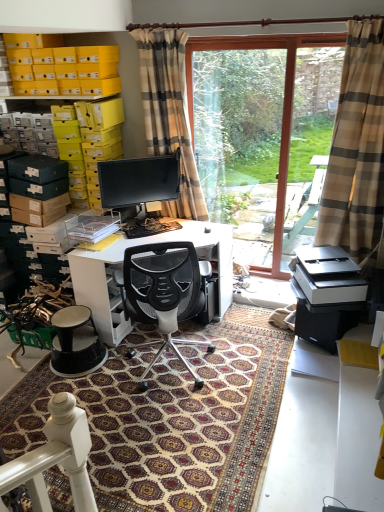
Image resolution: width=384 pixels, height=512 pixels. Identify the location of empty space that is ontop of white matte printer at lower right (from a real-world perspective). (319, 261).